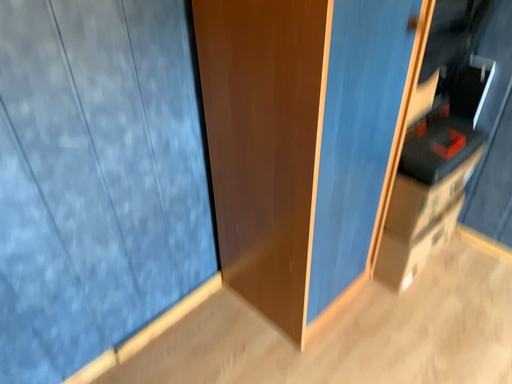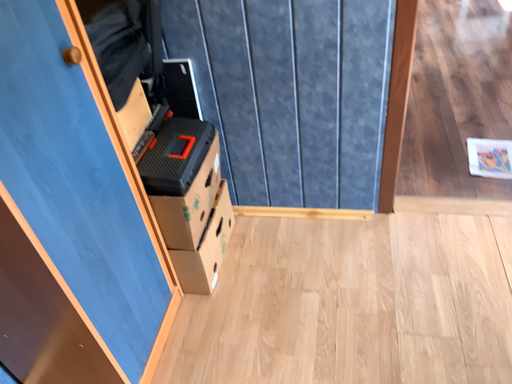
Question: How did the camera likely rotate when shooting the video?

Choices:
 (A) rotated right
 (B) rotated left

Answer: (A)